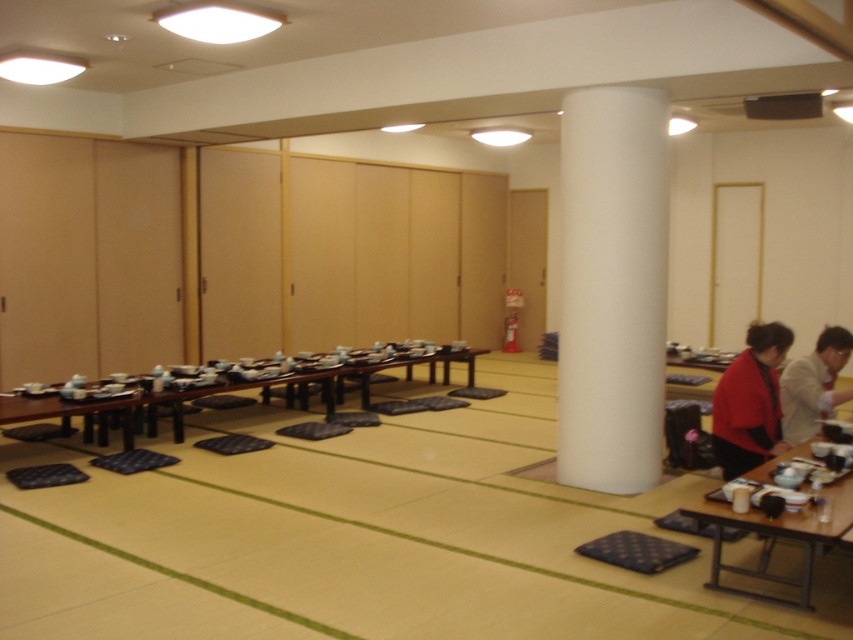
Who is shorter, wooden table at center or matte beige jacket at right?

wooden table at center is shorter.

Between point (299, 403) and point (827, 403), which one is positioned behind?

The point (299, 403) is more distant.

Which is in front, point (366, 385) or point (805, 369)?

Point (805, 369) is in front.

You are a GUI agent. You are given a task and a screenshot of the screen. Output one action in this format:
    pyautogui.click(x=<x>, y=<y>)
    Task: Click on the wooden table at center
    
    Given the screenshot: What is the action you would take?
    pyautogui.click(x=213, y=392)

Who is taller, white matte column at center or blue fabric mat at center?

white matte column at center is taller.

Does white matte column at center appear on the left side of blue fabric mat at center?

Incorrect, white matte column at center is not on the left side of blue fabric mat at center.

Is point (589, 291) positioned after point (231, 451)?

No, (589, 291) is closer to viewer.

This screenshot has width=853, height=640. I want to click on white matte column at center, so click(x=611, y=288).

Who is more distant from viewer, (715, 419) or (589, 547)?

Point (715, 419)

Which of these two, matte red jacket at right or dark blue textured mat at lower center, stands shorter?

With less height is dark blue textured mat at lower center.

Where is `matte red jacket at right`? This screenshot has width=853, height=640. matte red jacket at right is located at coordinates (750, 403).